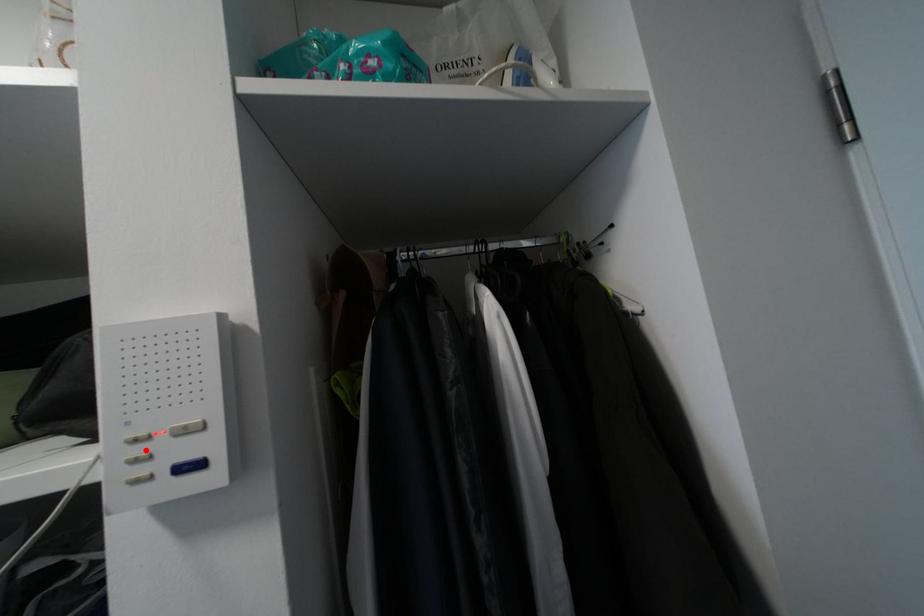
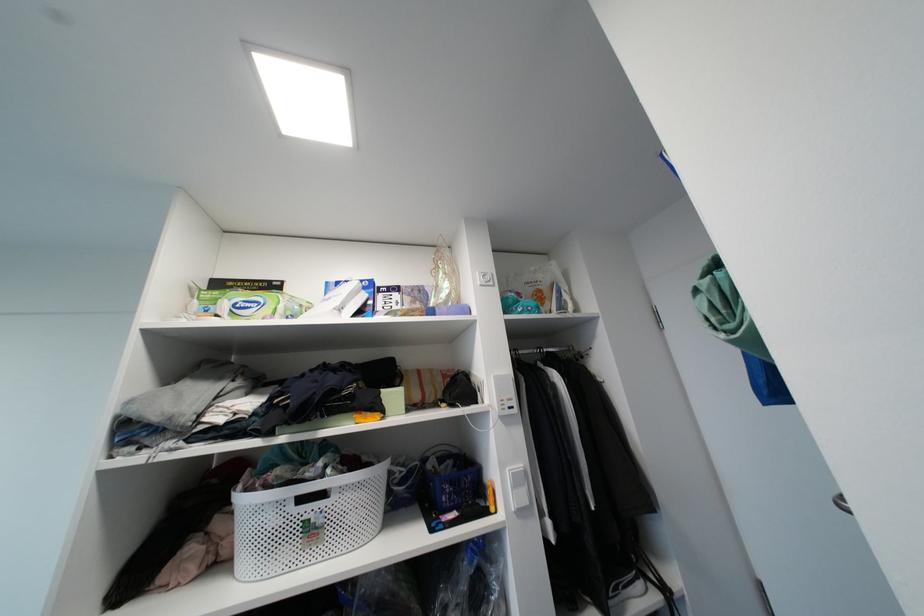
In the second image, find the point that corresponds to the highlighted location in the first image.

(506, 403)